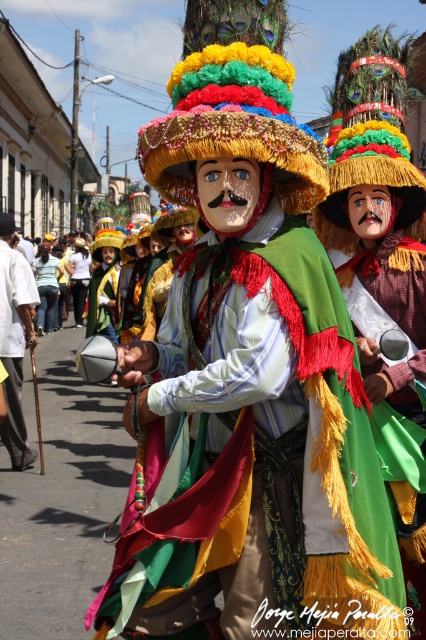
You are a photographer trying to capture the festive parade scene. You notice the multicolored fabric costume at center and the white cotton shirt at left. Which one is closer to the camera?

The multicolored fabric costume at center is closer to the camera than the white cotton shirt at left because it is positioned in front of it.